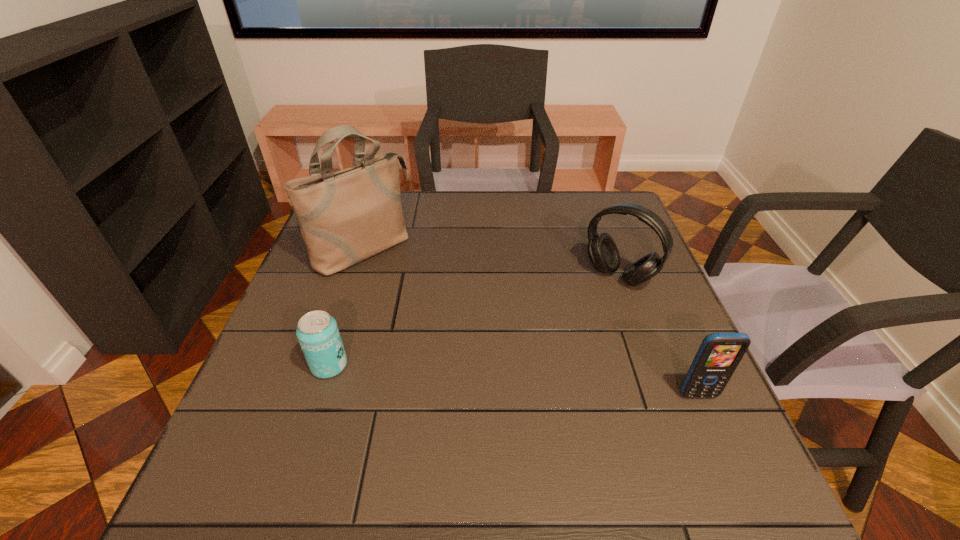
This screenshot has height=540, width=960. In order to click on unoccupied position between the headset and the tallest object in this screenshot , I will do `click(491, 262)`.

What are the coordinates of `vacant space that is in between the beer can and the cellular telephone` in the screenshot? It's located at (514, 380).

Identify the location of vacant area between the headset and the third farthest object. This screenshot has width=960, height=540. (474, 321).

Locate an element on the screen. This screenshot has height=540, width=960. vacant space that's between the shoulder bag and the third farthest object is located at coordinates (346, 307).

You are a GUI agent. You are given a task and a screenshot of the screen. Output one action in this format:
    pyautogui.click(x=<x>, y=<y>)
    Task: Click on the object that is the second closest to the nearest object
    
    Given the screenshot: What is the action you would take?
    pyautogui.click(x=317, y=332)

Choose which object is the second nearest neighbor to the nearest object. Please provide its 2D coordinates. Your answer should be formatted as a tuple, i.e. [(x, y)], where the tuple contains the x and y coordinates of a point satisfying the conditions above.

[(317, 332)]